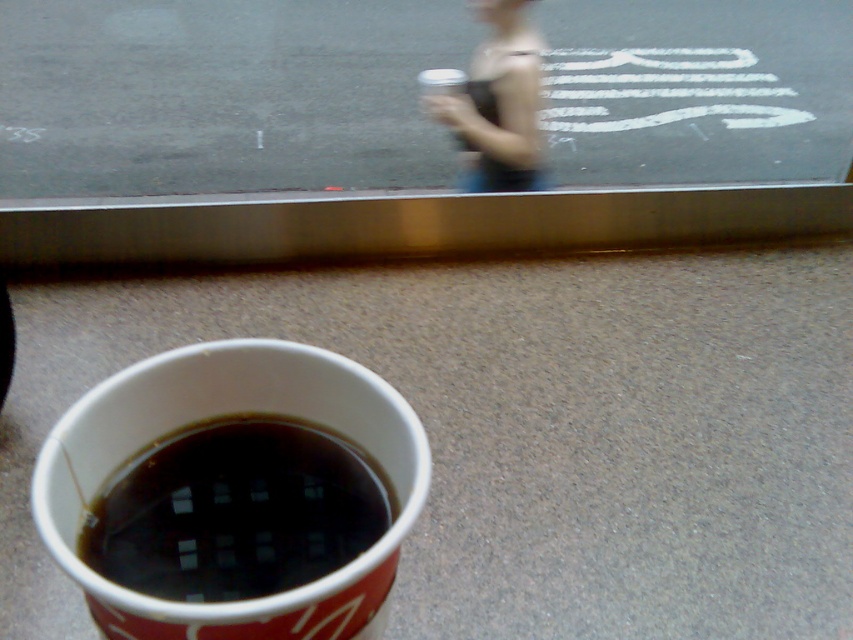
You are designing a packaging box for the black paper cup at lower left and the matte black tank top at upper center. Which item requires a wider packaging box to accommodate its width?

The matte black tank top at upper center requires a wider packaging box because the black paper cup at lower left is narrower than the matte black tank top at upper center.

You are a photographer trying to capture a clear image of the point at coordinates (309, 465). The camera you are using has a minimum focus distance of 90 centimeters. Will the camera be able to focus on the point?

The point at coordinates (309, 465) is 91.28 centimeters away from the camera, which exceeds the camera minimum focus distance of 90 centimeters. Therefore, the camera will not be able to focus on the point.

You are a passenger in the car and want to hand the black paper cup at lower left to the driver who is wearing the matte black tank top at upper center. Can you reach the cup without moving your seat?

The black paper cup at lower left is to the left of matte black tank top at upper center, so you can reach the cup without moving your seat since it is positioned to the left of the driver.